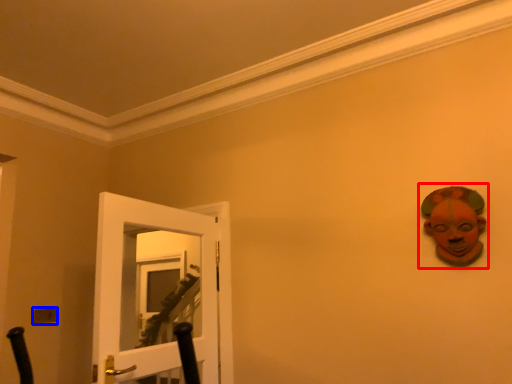
Question: Which object is further to the camera taking this photo, person (highlighted by a red box) or light switch (highlighted by a blue box)?

Choices:
 (A) person
 (B) light switch

Answer: (B)